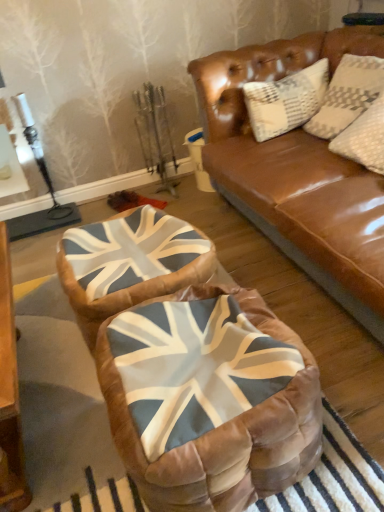
Question: Considering the positions of velvet union jack bean bag at center and union jack fabric swivel chair at center in the image, is velvet union jack bean bag at center bigger or smaller than union jack fabric swivel chair at center?

Choices:
 (A) small
 (B) big

Answer: (B)

Question: From a real-world perspective, relative to union jack fabric swivel chair at center, is velvet union jack bean bag at center vertically above or below?

Choices:
 (A) below
 (B) above

Answer: (B)

Question: Is velvet union jack bean bag at center situated inside union jack fabric swivel chair at center or outside?

Choices:
 (A) outside
 (B) inside

Answer: (A)

Question: From the image's perspective, is union jack fabric swivel chair at center located above or below velvet union jack bean bag at center?

Choices:
 (A) above
 (B) below

Answer: (A)

Question: Considering the positions of union jack fabric swivel chair at center and velvet union jack bean bag at center in the image, is union jack fabric swivel chair at center wider or thinner than velvet union jack bean bag at center?

Choices:
 (A) thin
 (B) wide

Answer: (A)

Question: Looking at the image, does union jack fabric swivel chair at center seem bigger or smaller compared to velvet union jack bean bag at center?

Choices:
 (A) small
 (B) big

Answer: (A)

Question: Choose the correct answer: Is union jack fabric swivel chair at center inside velvet union jack bean bag at center or outside it?

Choices:
 (A) inside
 (B) outside

Answer: (B)